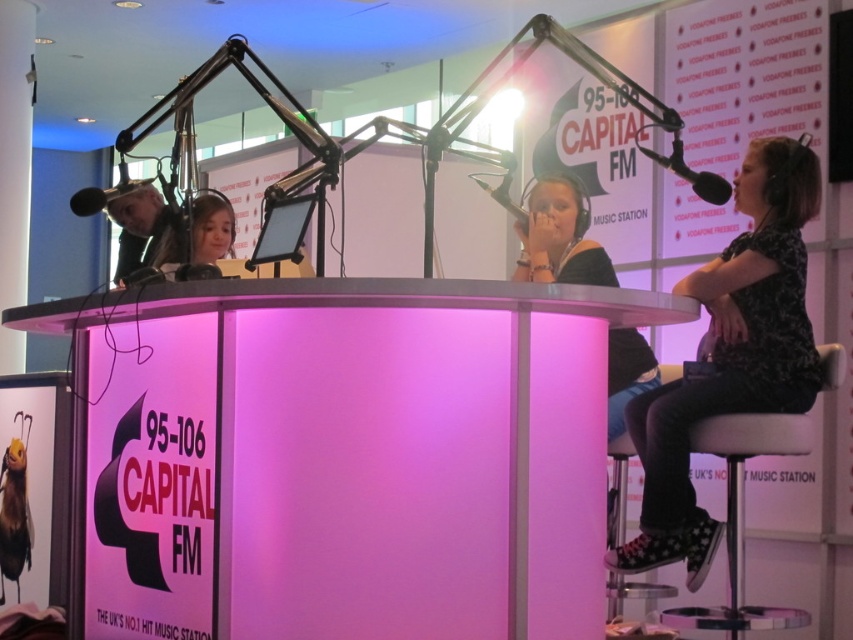
Question: Is matte black shirt at center closer to camera compared to metallic silver microphone at upper center?

Choices:
 (A) yes
 (B) no

Answer: (A)

Question: Which of these objects is positioned closest to the black matte microphone at left?

Choices:
 (A) floral-patterned shirt at right
 (B) metallic silver microphone at upper center

Answer: (B)

Question: Does floral-patterned shirt at right appear on the right side of black matte microphone at upper right?

Choices:
 (A) yes
 (B) no

Answer: (A)

Question: Which object appears farthest from the camera in this image?

Choices:
 (A) metallic silver microphone at upper center
 (B) matte black shirt at center
 (C) black matte microphone at left

Answer: (A)

Question: Is matte black shirt at center positioned behind black matte microphone at left?

Choices:
 (A) no
 (B) yes

Answer: (B)

Question: Which of the following is the farthest from the observer?

Choices:
 (A) black matte microphone at left
 (B) floral-patterned shirt at right

Answer: (B)